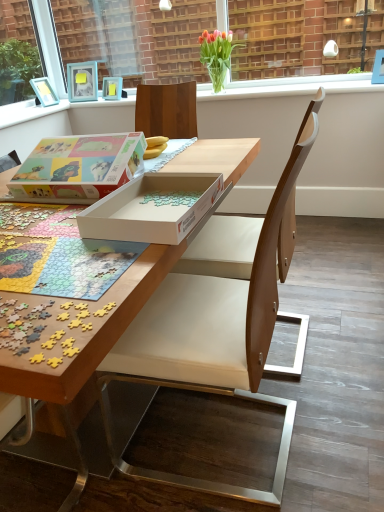
Identify the location of vacant space underneath wooden chair at center (from a real-world perspective). (248, 449).